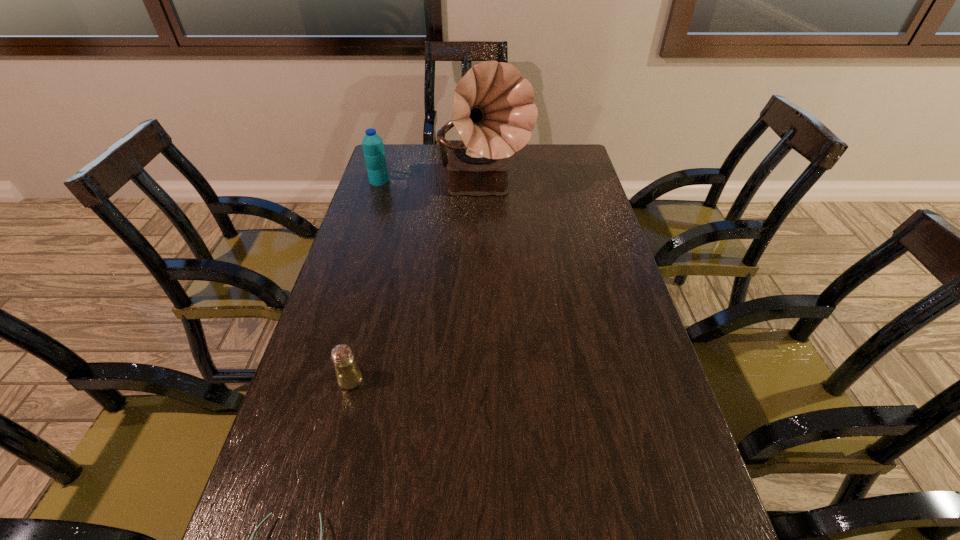
Where is `saltshaker that is at the left edge`? The width and height of the screenshot is (960, 540). saltshaker that is at the left edge is located at coordinates (348, 375).

Image resolution: width=960 pixels, height=540 pixels. I want to click on free spot at the far edge of the desktop, so click(x=524, y=158).

Where is `free space at the left edge`? free space at the left edge is located at coordinates (392, 221).

The image size is (960, 540). Find the location of `free space at the right edge of the desktop`. free space at the right edge of the desktop is located at coordinates (566, 236).

Identify the location of empty location between the tallest object and the second tallest object. The image size is (960, 540). (431, 185).

Locate an element on the screen. The height and width of the screenshot is (540, 960). unoccupied area between the second tallest object and the record player is located at coordinates click(431, 185).

This screenshot has height=540, width=960. I want to click on empty space that is in between the saltshaker and the rightmost object, so click(417, 285).

Where is `free space between the tallest object and the third shortest object`? free space between the tallest object and the third shortest object is located at coordinates (431, 185).

The width and height of the screenshot is (960, 540). Identify the location of free space between the record player and the second nearest object. (417, 285).

Locate which object ranks second in proximity to the rightmost object. Please provide its 2D coordinates. Your answer should be formatted as a tuple, i.e. [(x, y)], where the tuple contains the x and y coordinates of a point satisfying the conditions above.

[(348, 375)]